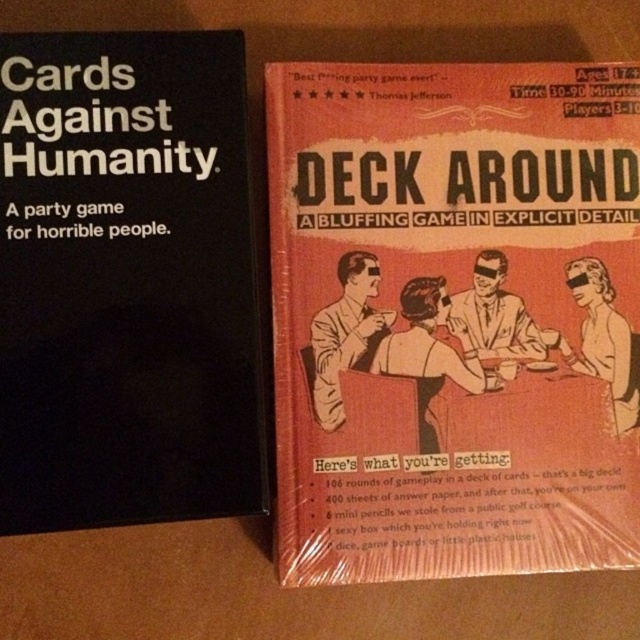
Question: Is matte cardboard book at center thinner than black matte box at left?

Choices:
 (A) no
 (B) yes

Answer: (A)

Question: Which object is farther from the camera taking this photo?

Choices:
 (A) black matte box at left
 (B) matte cardboard book at center

Answer: (B)

Question: Does matte cardboard book at center appear on the right side of black matte box at left?

Choices:
 (A) yes
 (B) no

Answer: (A)

Question: Is matte cardboard book at center above black matte box at left?

Choices:
 (A) yes
 (B) no

Answer: (B)

Question: Which point is farther to the camera?

Choices:
 (A) matte cardboard book at center
 (B) black matte box at left

Answer: (A)